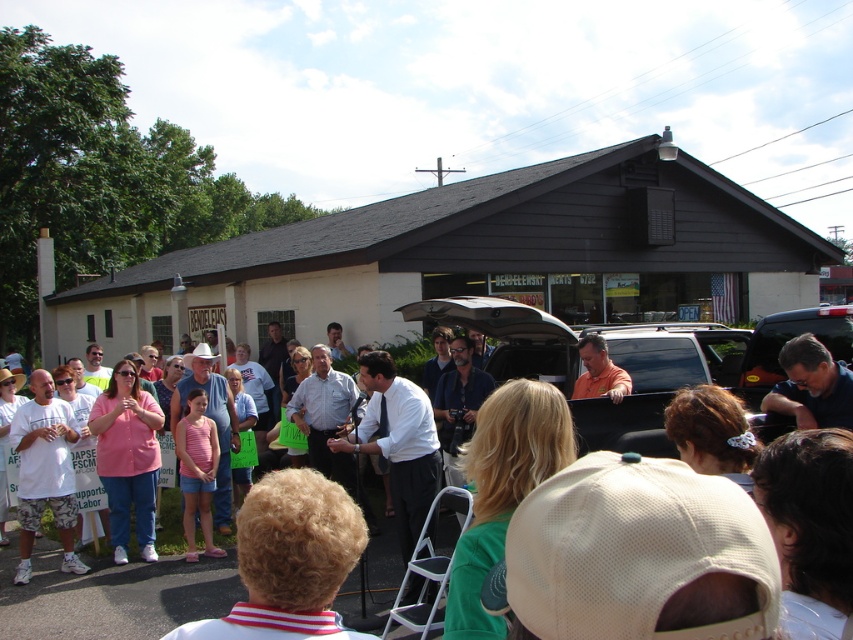
Question: Which point is closer to the camera taking this photo?

Choices:
 (A) (322, 605)
 (B) (831, 356)

Answer: (A)

Question: Estimate the real-world distances between objects in this image. Which object is closer to the pink fabric shirt at center?

Choices:
 (A) orange fabric car at center
 (B) pink fabric dress at center
 (C) brown hair at center

Answer: (B)

Question: Does matte black shirt at center have a larger size compared to orange matte shirt at center?

Choices:
 (A) yes
 (B) no

Answer: (A)

Question: Which point is closer to the camera taking this photo?

Choices:
 (A) (502, 548)
 (B) (605, 371)
 (C) (738, 412)
 (D) (47, 390)

Answer: (A)

Question: Can you confirm if brown hair at center is positioned to the right of orange matte shirt at center?

Choices:
 (A) yes
 (B) no

Answer: (B)

Question: Can you confirm if blonde hair at center is wider than matte black shirt at center?

Choices:
 (A) no
 (B) yes

Answer: (A)